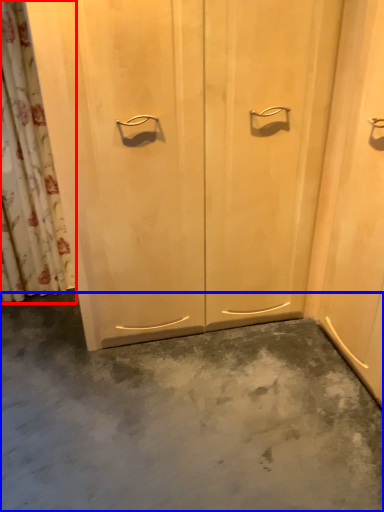
Question: Which object is closer to the camera taking this photo, shower curtain (highlighted by a red box) or concrete (highlighted by a blue box)?

Choices:
 (A) shower curtain
 (B) concrete

Answer: (B)